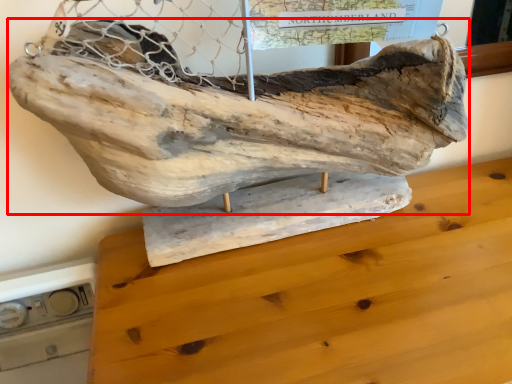
Question: Considering the relative positions of sculpture (annotated by the red box) and furniture in the image provided, where is sculpture (annotated by the red box) located with respect to the staircase?

Choices:
 (A) right
 (B) left

Answer: (B)